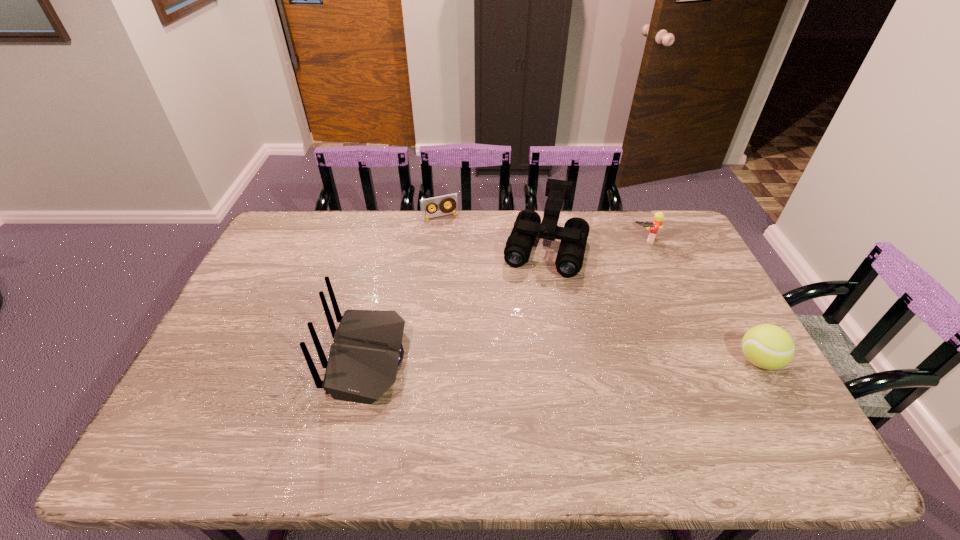
The height and width of the screenshot is (540, 960). I want to click on vacant space on the desktop that is between the router and the tennis ball and is positioned on the front lenses of the third object from right to left, so click(514, 359).

At what (x,y) coordinates should I click in order to perform the action: click on free spot on the desktop that is between the router and the tennis ball and is positioned in front of the Lego with the accessory visible. Please return your answer as a coordinate pair (x, y). This screenshot has height=540, width=960. Looking at the image, I should click on (601, 360).

Where is `free space on the desktop that is between the router and the tennis ball and is positioned at the front of the videotape with visible reels`? The image size is (960, 540). free space on the desktop that is between the router and the tennis ball and is positioned at the front of the videotape with visible reels is located at coordinates (510, 359).